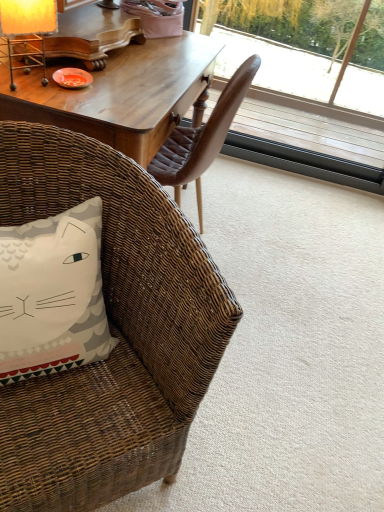
Identify the location of free area behind matte yellow lampshade at upper left. (64, 68).